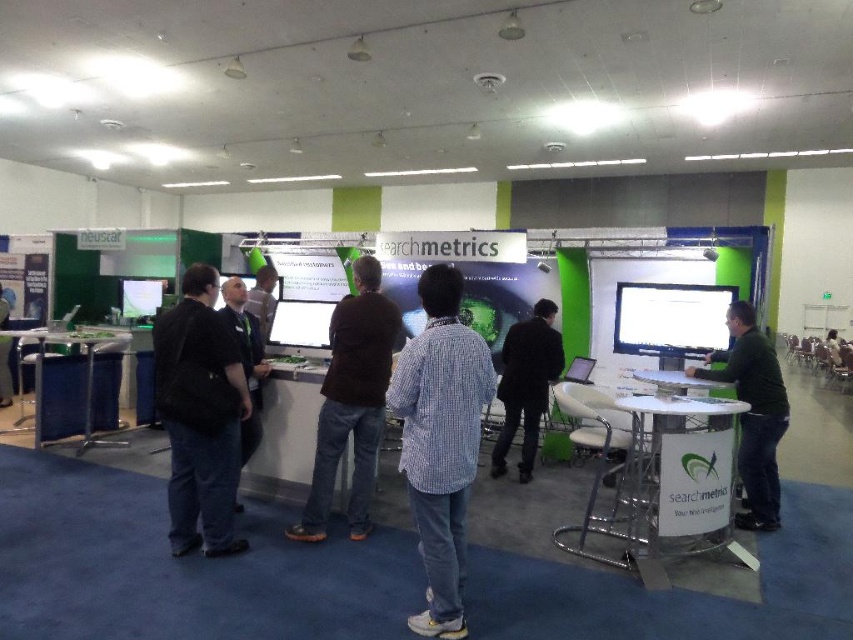
You are attending a trade show and notice two attendees wearing a brown sweater at center and a dark brown leather jacket at center. Which clothing item is positioned more to the left?

The brown sweater at center is positioned more to the left than the dark brown leather jacket at center.

You are attending a trade show and notice a person wearing a matte black shirt at center. If you want to approach them, which direction should you move from your current position at point A, which is located at the entrance of the exhibition hall?

The matte black shirt at center is located at point (x=262, y=300), so you should move towards the center of the exhibition hall to reach them.